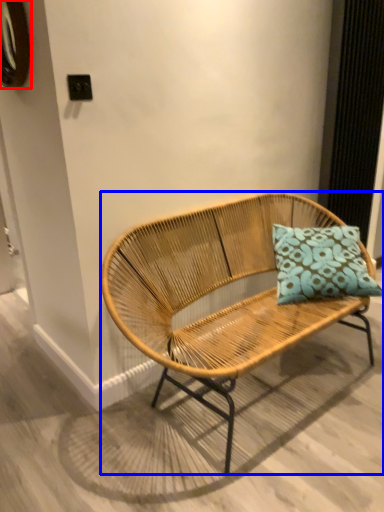
Question: Which object is closer to the camera taking this photo, oval (highlighted by a red box) or bench (highlighted by a blue box)?

Choices:
 (A) oval
 (B) bench

Answer: (B)